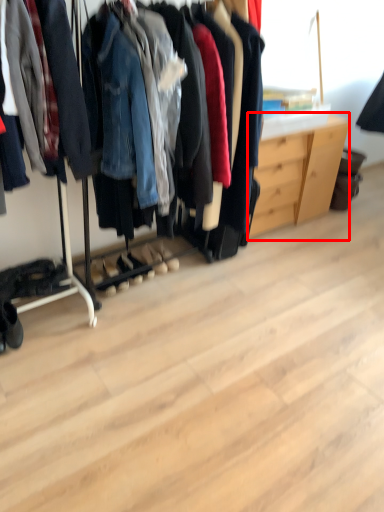
Question: Observing the image, what is the correct spatial positioning of dresser (annotated by the red box) in reference to footwear?

Choices:
 (A) left
 (B) right

Answer: (B)